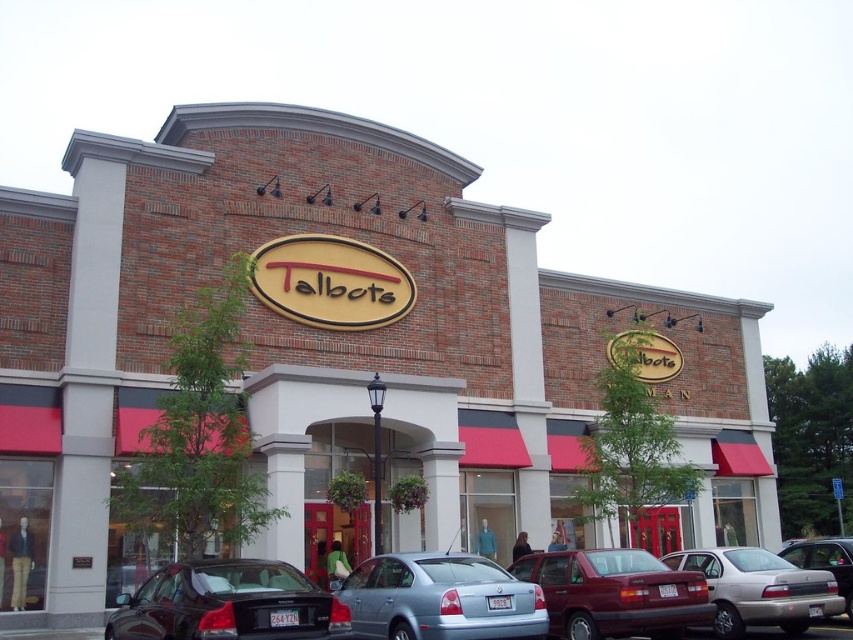
Question: Is metallic blue sedan at center smaller than matte red sedan at center?

Choices:
 (A) no
 (B) yes

Answer: (A)

Question: Which of the following is the closest to the observer?

Choices:
 (A) metallic silver sedan at lower right
 (B) silver metallic sedan at center
 (C) matte red sedan at center

Answer: (C)

Question: Estimate the real-world distances between objects in this image. Which object is farther from the shiny black sedan at lower left?

Choices:
 (A) metallic silver sedan at lower right
 (B) metallic blue sedan at center
 (C) matte red sedan at center

Answer: (A)

Question: Does matte red sedan at center lie in front of silver metallic sedan at center?

Choices:
 (A) no
 (B) yes

Answer: (B)

Question: Considering the relative positions of matte red sedan at center and metallic silver sedan at lower right in the image provided, where is matte red sedan at center located with respect to metallic silver sedan at lower right?

Choices:
 (A) left
 (B) right

Answer: (A)

Question: Which is farther from the metallic blue sedan at center?

Choices:
 (A) matte red sedan at center
 (B) silver metallic sedan at center
 (C) shiny black sedan at lower left
 (D) metallic silver sedan at lower right

Answer: (D)